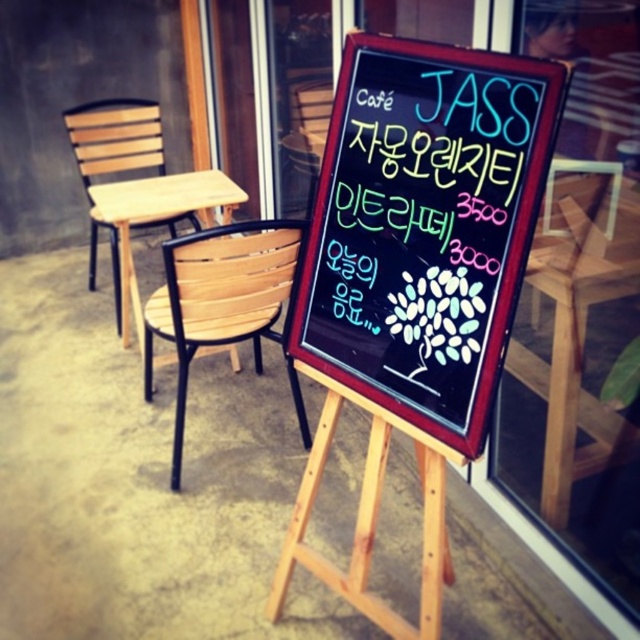
You are a customer at the cafe and want to order the Mint Latte priced at 3000. The menu is displayed on a chalkboard mounted on a wooden easel with wooden slats at left. Where on the chalkboard should you look to find the price of the Mint Latte?

The price of the Mint Latte is listed next to its name on the chalkboard. Since the Mint Latte is written in green, you should look for the green text labeled 3000 near the bottom of the chalkboard.

You are a customer at the cafe and want to order the cheapest drink listed on the menu. Which drink should you choose based on the prices shown on the black chalkboard at center and wooden slats at left?

The Mint Latte is priced at 3000, which is cheaper than the Mandarin Orange Tea at 3500. Therefore, you should choose the Mint Latte.